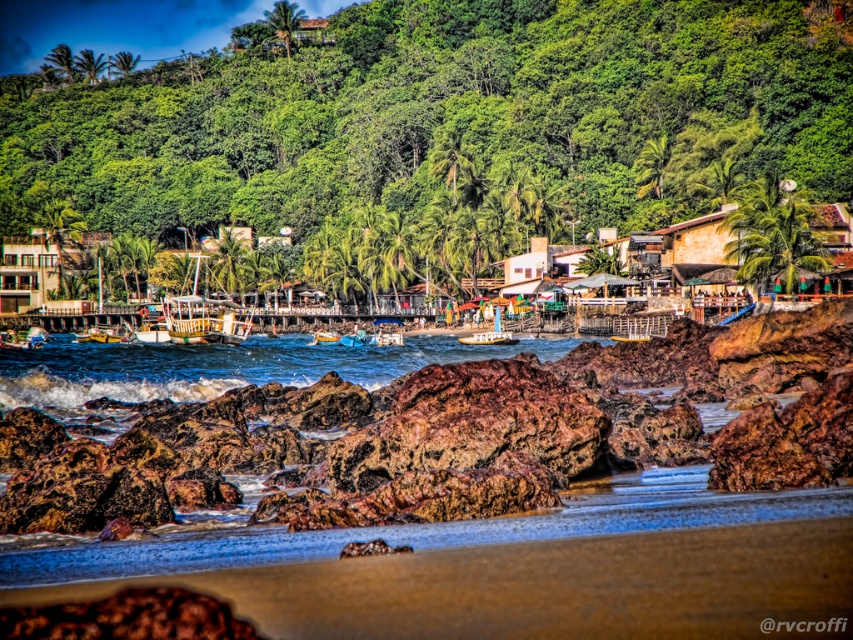
Is green leafy hillside at upper center taller than bright yellow plastic boat at center?

Indeed, green leafy hillside at upper center has a greater height compared to bright yellow plastic boat at center.

Which is in front, point (735, 109) or point (495, 320)?

Point (495, 320) is more forward.

This screenshot has width=853, height=640. What are the coordinates of `green leafy hillside at upper center` in the screenshot? It's located at (440, 129).

This screenshot has height=640, width=853. Identify the location of green leafy hillside at upper center. (440, 129).

Which is behind, point (0, 340) or point (357, 337)?

Point (357, 337)

Between metallic silver boat at lower left and bright blue plastic boat at center, which one appears on the right side from the viewer's perspective?

bright blue plastic boat at center

Identify the location of metallic silver boat at lower left. The height and width of the screenshot is (640, 853). (22, 339).

Can you confirm if metallic silver boat at lower left is positioned to the right of bright yellow plastic boat at center?

Incorrect, metallic silver boat at lower left is not on the right side of bright yellow plastic boat at center.

Consider the image. Can you confirm if metallic silver boat at lower left is shorter than bright yellow plastic boat at center?

Yes.

Between point (9, 337) and point (512, 342), which one is positioned in front?

Point (512, 342)

In order to click on metallic silver boat at lower left in this screenshot , I will do pyautogui.click(x=22, y=339).